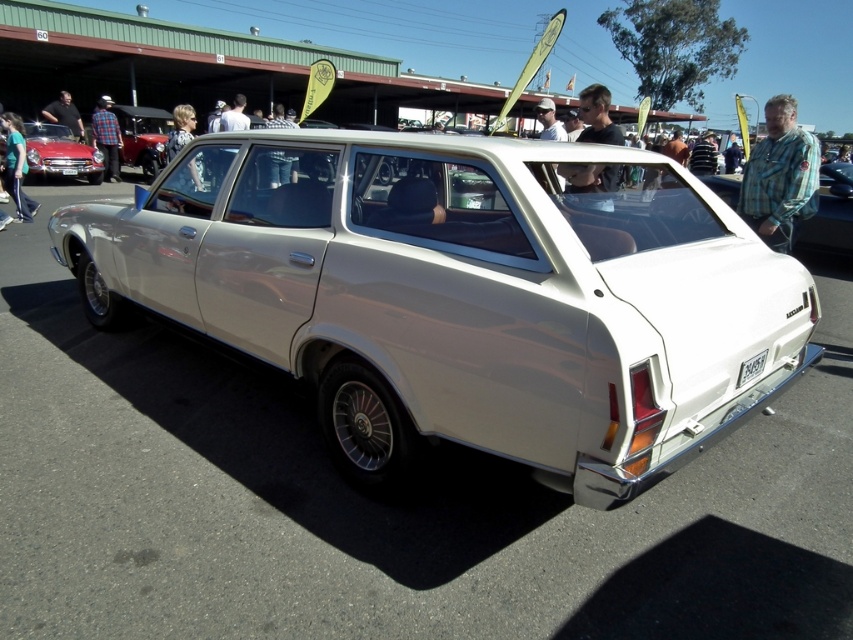
You are at a car show and see two people wearing shirts. One is wearing a checkered fabric shirt at center and the other a matte black shirt at left. Which person is standing closer to the vintage station wagon?

The checkered fabric shirt at center is taller than the matte black shirt at left, but height does not determine proximity. The question cannot be answered with the given information.

You are a photographer standing at the position of the matte black shirt at left. You want to take a photo of the white plastic license plate at lower center without moving. Can you do it with a standard camera lens that has a maximum focal length of 200mm?

The distance between the matte black shirt at left and the white plastic license plate at lower center is 19.33 meters. With a standard camera lens of 200mm focal length, you can capture the white plastic license plate at lower center from that distance without needing to move.

You are a photographer trying to capture a clear shot of the matte black shirt at left and the white plastic license plate at lower center. Since you want both subjects to be in focus, which one should you adjust your camera focus on first, the one closer to you or the one further away?

The matte black shirt at left has a greater height compared to the white plastic license plate at lower center, so the shirt is closer to you. To ensure both are in focus, you should focus on the matte black shirt at left first as it is closer, then the license plate will be further away in the depth of field.